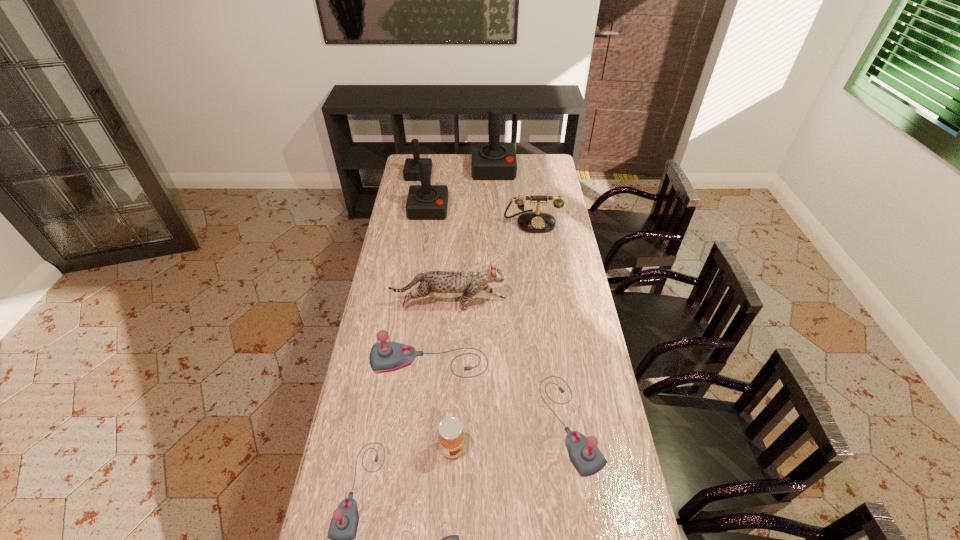
The image size is (960, 540). Find the location of `empty space that is in between the smallest red joystick and the telephone`. empty space that is in between the smallest red joystick and the telephone is located at coordinates (475, 198).

Locate which object ranks ninth in proximity to the smallest red joystick. Please provide its 2D coordinates. Your answer should be formatted as a tuple, i.e. [(x, y)], where the tuple contains the x and y coordinates of a point satisfying the conditions above.

[(451, 539)]

You are a GUI agent. You are given a task and a screenshot of the screen. Output one action in this format:
    pyautogui.click(x=<x>, y=<y>)
    Task: Click on the seventh closest object to the sixth nearest object
    
    Given the screenshot: What is the action you would take?
    pyautogui.click(x=451, y=539)

This screenshot has width=960, height=540. Find the location of `the fifth closest joystick relative to the cat`. the fifth closest joystick relative to the cat is located at coordinates (451, 539).

Locate an element on the screen. The width and height of the screenshot is (960, 540). joystick that is the sixth nearest to the second shortest joystick is located at coordinates (490, 161).

Find the location of a particular element. This screenshot has width=960, height=540. the closest red joystick relative to the fifth nearest joystick is located at coordinates (411, 167).

This screenshot has height=540, width=960. Identify the location of red joystick that is the closest to the second shortest joystick. (424, 202).

Point out which gray joystick is positioned as the third nearest to the telephone. Please provide its 2D coordinates. Your answer should be formatted as a tuple, i.e. [(x, y)], where the tuple contains the x and y coordinates of a point satisfying the conditions above.

[(343, 527)]

Find the location of a particular element. the third closest gray joystick relative to the second tallest object is located at coordinates (343, 527).

Where is `free spot that satisfies the following two spatial constraints: 1. on the base of the rightmost red joystick; 2. on the face of the cat`? This screenshot has height=540, width=960. free spot that satisfies the following two spatial constraints: 1. on the base of the rightmost red joystick; 2. on the face of the cat is located at coordinates (499, 305).